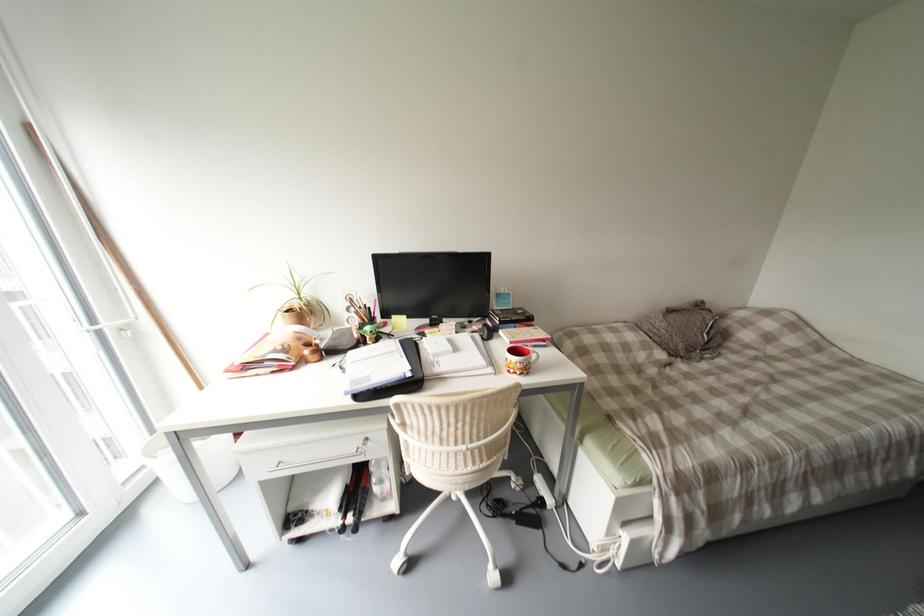
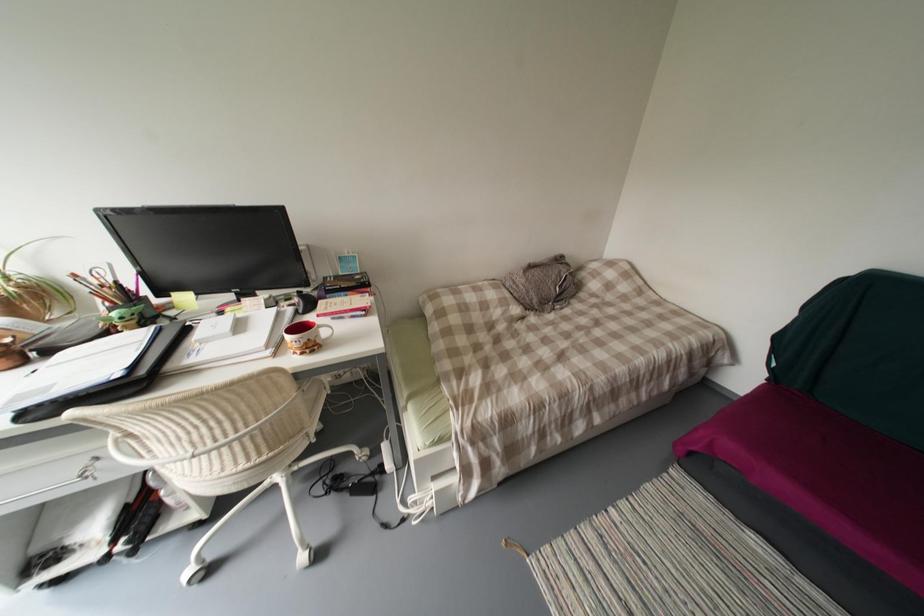
Question: The camera is either moving clockwise (left) or counter-clockwise (right) around the object. The first image is from the beginning of the video and the second image is from the end. Is the camera moving left or right when shooting the video?

Choices:
 (A) Left
 (B) Right

Answer: (A)